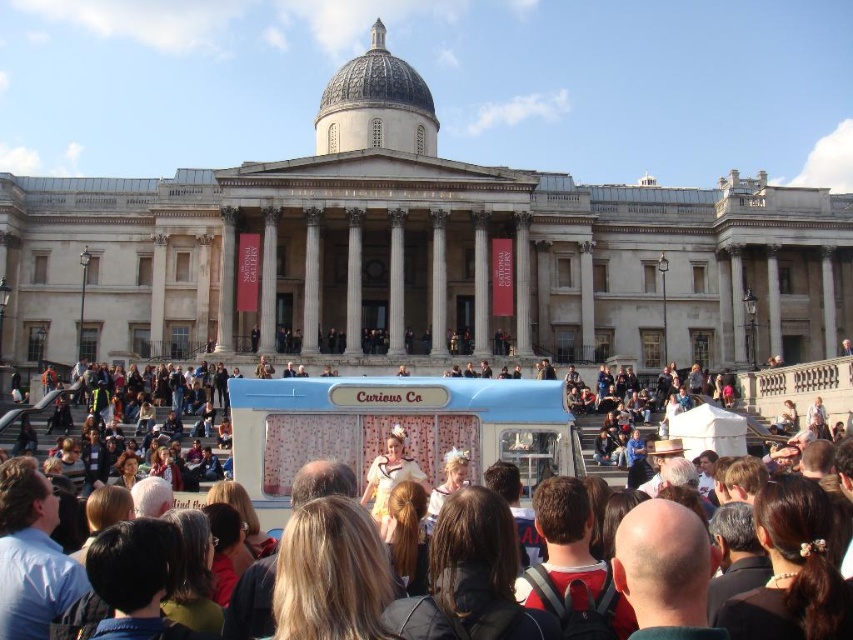
You are standing in front of a grand neoclassical building with a vintage bus and performers nearby. There is a point marked at coordinates point (525, 493). If you want to place a new bench exactly 70 meters away from this point, will it be far enough to ensure it doesn

The distance of point (525, 493) from viewer is 68.77 meters. Placing a bench exactly 70 meters away would mean it is 1.23 meters farther than the current distance of the point, so yes, it would be far enough.